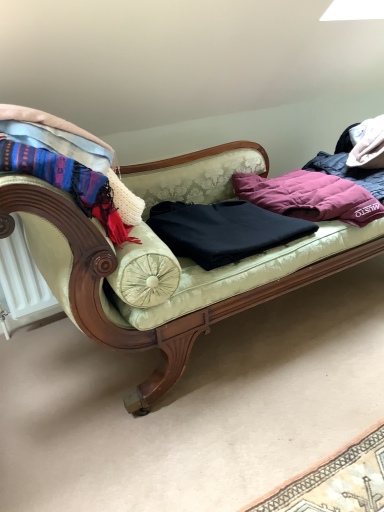
Question: From the image's perspective, would you say knitted wool scarf at left is positioned over velvet green couch at center?

Choices:
 (A) no
 (B) yes

Answer: (B)

Question: Would you say knitted wool scarf at left is outside velvet green couch at center?

Choices:
 (A) yes
 (B) no

Answer: (B)

Question: Can you confirm if knitted wool scarf at left is positioned to the right of velvet green couch at center?

Choices:
 (A) yes
 (B) no

Answer: (B)

Question: Are knitted wool scarf at left and velvet green couch at center far apart?

Choices:
 (A) yes
 (B) no

Answer: (B)

Question: Can you confirm if knitted wool scarf at left is wider than velvet green couch at center?

Choices:
 (A) yes
 (B) no

Answer: (B)

Question: From a real-world perspective, is knitted wool scarf at left under velvet green couch at center?

Choices:
 (A) no
 (B) yes

Answer: (A)

Question: Considering the relative positions of purple down jacket at center, marked as the 2th clothing in a left-to-right arrangement, and black matte sweater at center, placed as the second clothing when sorted from right to left, in the image provided, is purple down jacket at center, marked as the 2th clothing in a left-to-right arrangement, to the right of black matte sweater at center, placed as the second clothing when sorted from right to left, from the viewer's perspective?

Choices:
 (A) no
 (B) yes

Answer: (B)

Question: Is purple down jacket at center, marked as the 2th clothing in a left-to-right arrangement, far away from black matte sweater at center, placed as the second clothing when sorted from right to left?

Choices:
 (A) no
 (B) yes

Answer: (A)

Question: Can you confirm if purple down jacket at center, positioned as the 1th clothing in right-to-left order, is wider than black matte sweater at center, placed as the second clothing when sorted from right to left?

Choices:
 (A) no
 (B) yes

Answer: (B)

Question: Is purple down jacket at center, marked as the 2th clothing in a left-to-right arrangement, facing away from black matte sweater at center, placed as the second clothing when sorted from right to left?

Choices:
 (A) yes
 (B) no

Answer: (B)

Question: Can you confirm if purple down jacket at center, positioned as the 1th clothing in right-to-left order, is bigger than black matte sweater at center, the first clothing positioned from the left?

Choices:
 (A) no
 (B) yes

Answer: (B)

Question: Is purple down jacket at center, marked as the 2th clothing in a left-to-right arrangement, smaller than black matte sweater at center, the first clothing positioned from the left?

Choices:
 (A) yes
 (B) no

Answer: (B)

Question: From a real-world perspective, is velvet green couch at center below black matte sweater at center, placed as the second clothing when sorted from right to left?

Choices:
 (A) no
 (B) yes

Answer: (B)